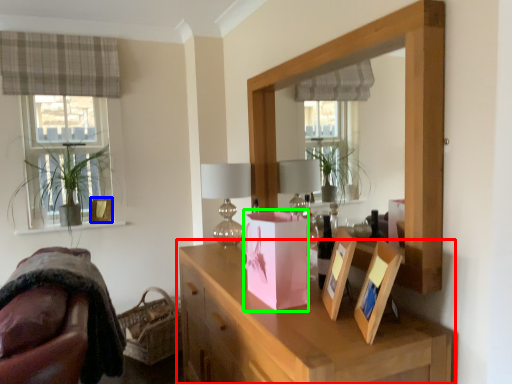
Question: Which object is positioned closest to cabinetry (highlighted by a red box)? Select from picture frame (highlighted by a blue box) and package (highlighted by a green box).

Choices:
 (A) picture frame
 (B) package

Answer: (B)